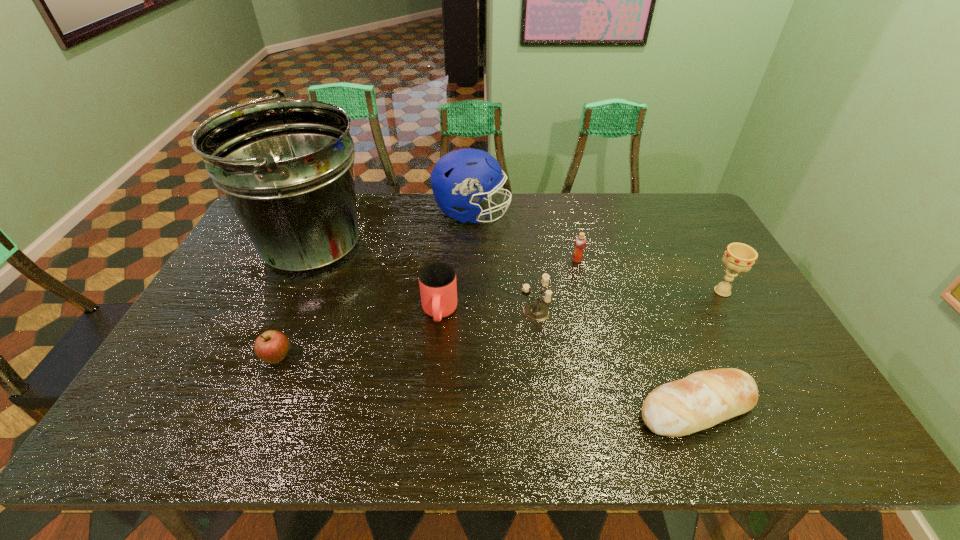
Where is `object situated at the near edge`? The image size is (960, 540). object situated at the near edge is located at coordinates (703, 399).

The height and width of the screenshot is (540, 960). Identify the location of object located at the left edge. (285, 167).

At what (x,y) coordinates should I click in order to perform the action: click on chalice positioned at the right edge. Please return your answer as a coordinate pair (x, y). Looking at the image, I should click on (739, 257).

You are a GUI agent. You are given a task and a screenshot of the screen. Output one action in this format:
    pyautogui.click(x=<x>, y=<y>)
    Task: Click on the bread present at the right edge
    This screenshot has width=960, height=540.
    Given the screenshot: What is the action you would take?
    pyautogui.click(x=703, y=399)

Where is `object that is at the far left corner`? The width and height of the screenshot is (960, 540). object that is at the far left corner is located at coordinates (285, 167).

Locate an element on the screen. The height and width of the screenshot is (540, 960). object that is at the near right corner is located at coordinates (703, 399).

This screenshot has width=960, height=540. I want to click on vacant space at the far edge, so click(536, 207).

In the image, there is a desktop. At what (x,y) coordinates should I click in order to perform the action: click on free space at the near edge. Please return your answer as a coordinate pair (x, y). Looking at the image, I should click on (259, 414).

In the image, there is a desktop. Where is `vacant area at the left edge`? The width and height of the screenshot is (960, 540). vacant area at the left edge is located at coordinates [226, 271].

This screenshot has height=540, width=960. Identify the location of vacant space at the right edge of the desktop. pos(785,352).